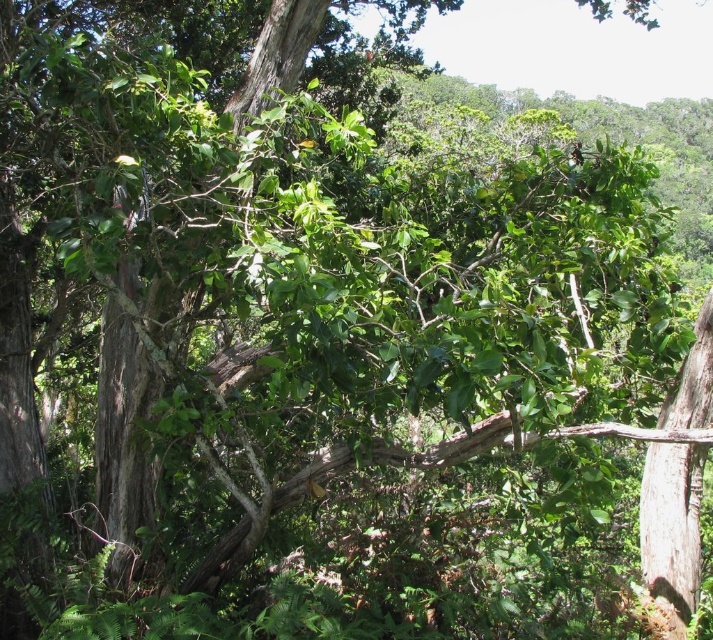
You are standing in the forest and want to take a photo of the brown rough tree trunk at center. Where should you position yourself to capture it in the frame?

The brown rough tree trunk at center is located at the 2D coordinates point (125, 416), so you should position yourself facing the center of the image to capture it in the frame.

You are standing in the forest and see the brown rough tree trunk at center. If you walk directly towards the tree trunk, will you first encounter the point marked at coordinates (x=125, y=416)?

Yes, the point marked at (x=125, y=416) is exactly on the brown rough tree trunk at center, so walking directly towards the trunk would lead you to that point first.